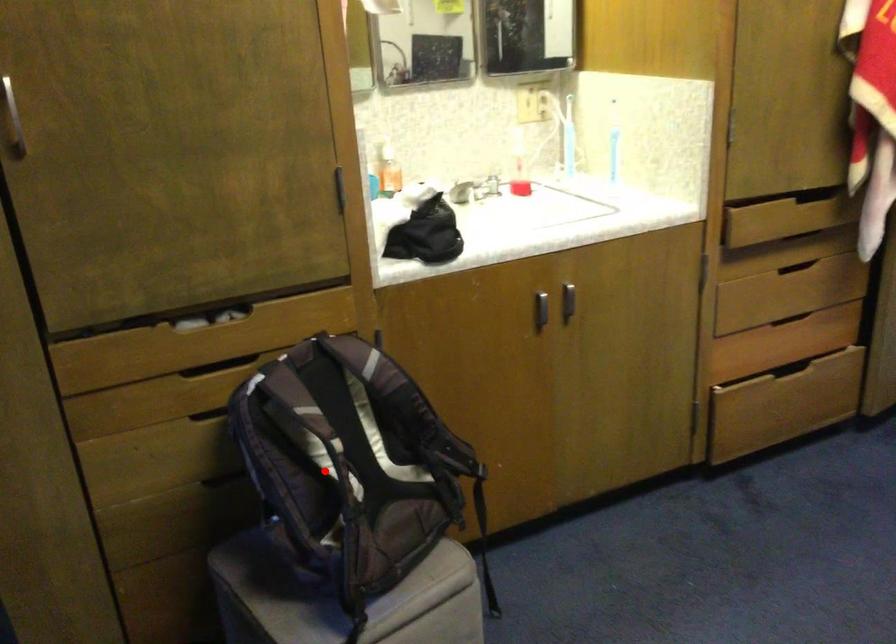
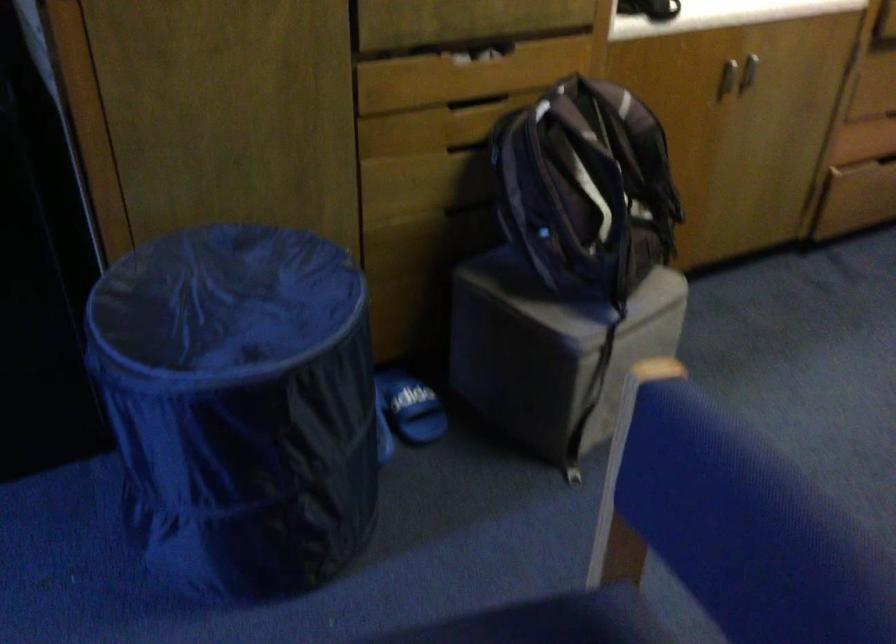
Question: I am providing you with two images of the same scene from different viewpoints. Image1 has a red point marked. In image2, the corresponding 3D location appears at what relative position? Reply with the corresponding letter.

Choices:
 (A) Closer
 (B) Farther

Answer: (B)